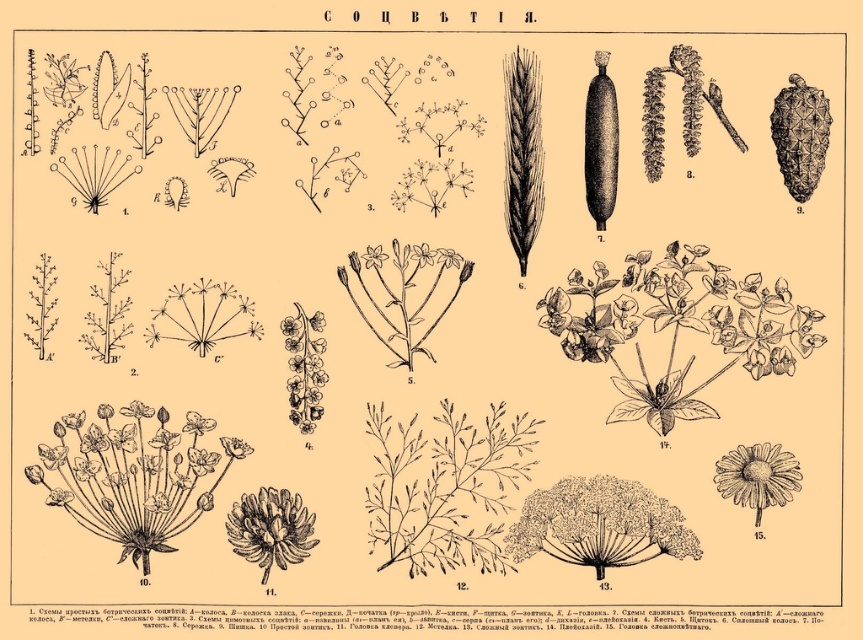
Question: Can you confirm if smooth green leaves at center is smaller than brown textured flower at center?

Choices:
 (A) no
 (B) yes

Answer: (A)

Question: Which point is closer to the camera?

Choices:
 (A) white textured flower at lower right
 (B) white fluffy flower at center
 (C) smooth green leaves at center
 (D) brown textured flower at center

Answer: (A)

Question: Which point appears closest to the camera in this image?

Choices:
 (A) (767, 493)
 (B) (552, 298)
 (C) (273, 531)
 (D) (520, 556)

Answer: (A)

Question: Is smooth green leaves at center to the right of white textured flower at lower right from the viewer's perspective?

Choices:
 (A) yes
 (B) no

Answer: (B)

Question: Which point is closer to the camera?

Choices:
 (A) white textured flower at lower right
 (B) brown textured flower at center
 (C) white fluffy flower at center

Answer: (A)

Question: Is smooth green leaves at center below brown textured flower at center?

Choices:
 (A) no
 (B) yes

Answer: (A)